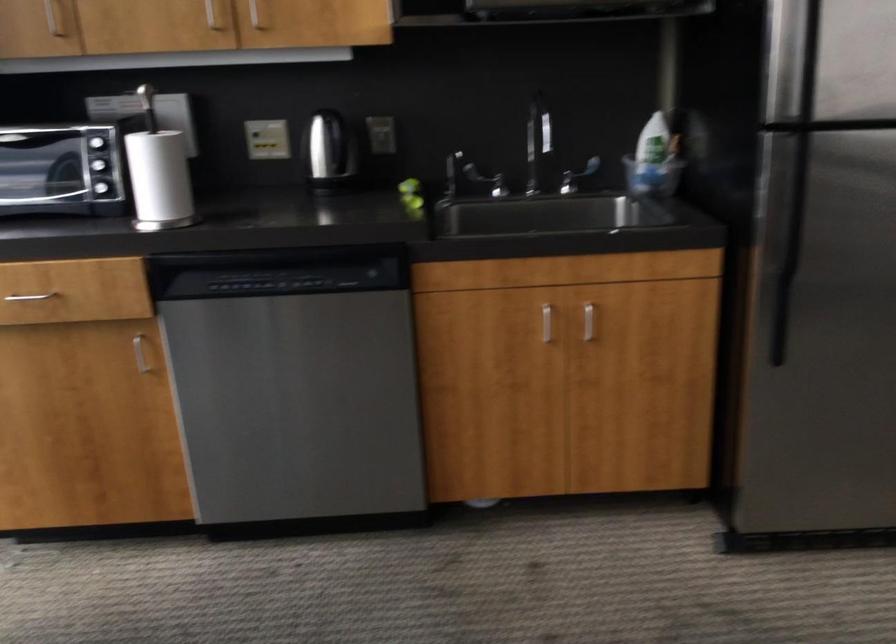
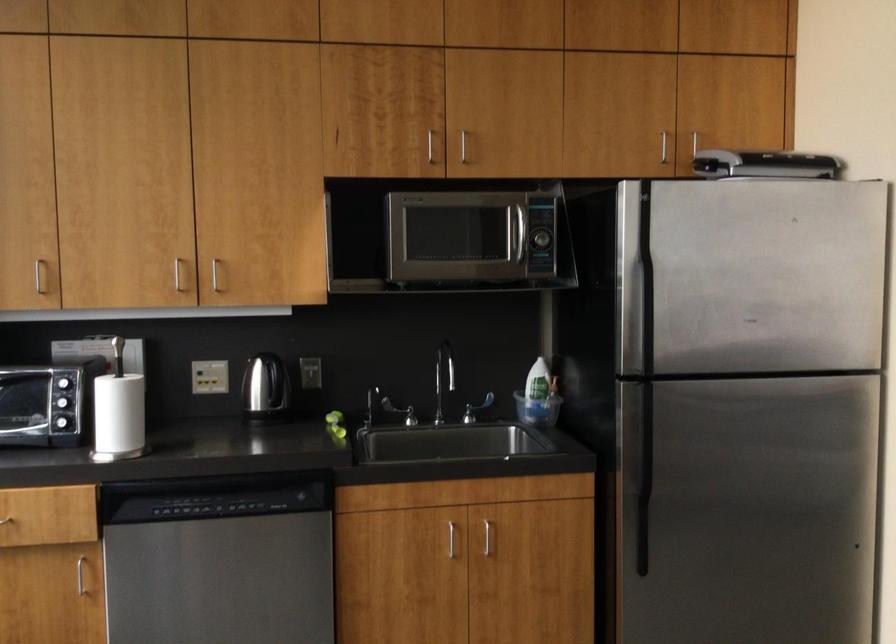
The point at [543,321] is marked in the first image. Where is the corresponding point in the second image?

(450, 538)